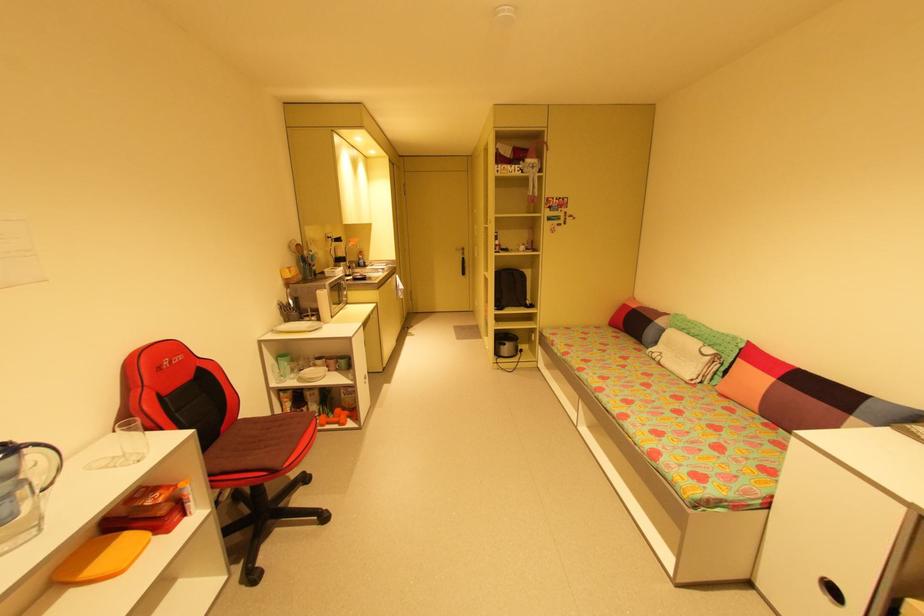
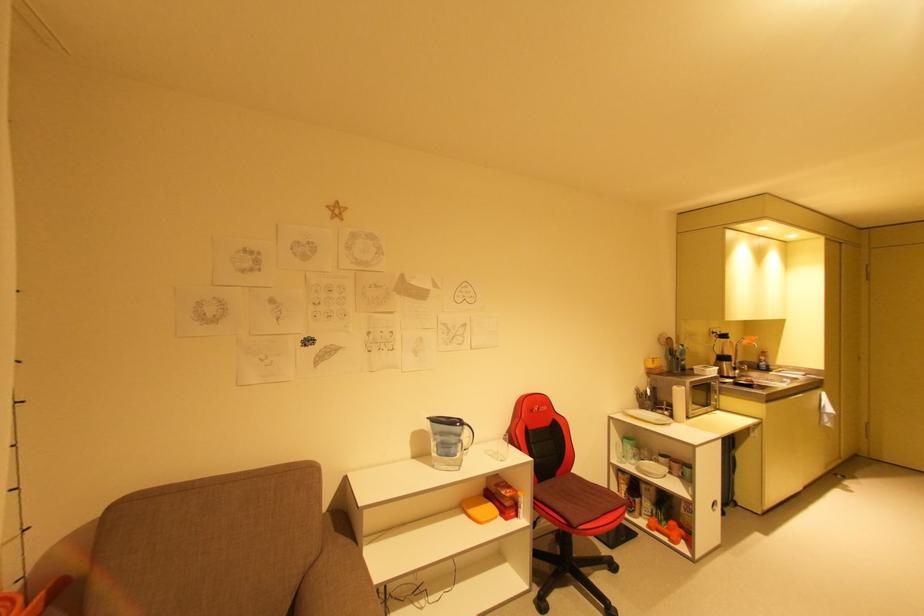
The point at (x=372, y=268) is marked in the first image. Where is the corresponding point in the second image?

(776, 373)